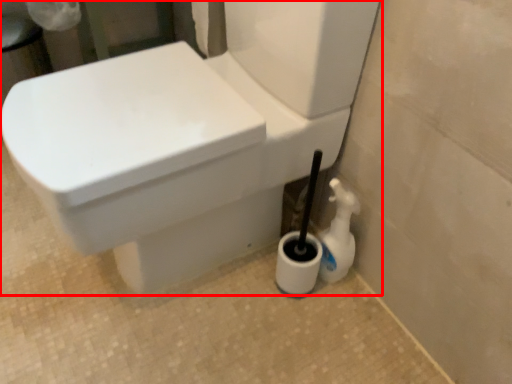
Question: From the image's perspective, what is the correct spatial positioning of toilet (annotated by the red box) in reference to cleaning product?

Choices:
 (A) below
 (B) above

Answer: (B)